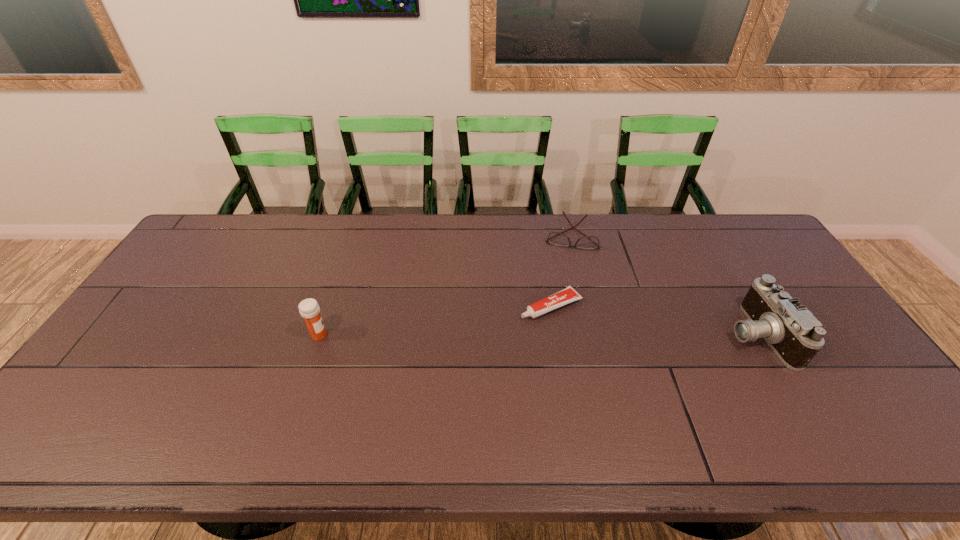
Locate an element on the screen. This screenshot has width=960, height=540. free location located 0.320m at the nozzle of the shortest object is located at coordinates (x=425, y=359).

The image size is (960, 540). Find the location of `free location located 0.150m at the nozzle of the shortest object`. free location located 0.150m at the nozzle of the shortest object is located at coordinates (480, 334).

Locate an element on the screen. The height and width of the screenshot is (540, 960). free location located on the front-facing side of the farthest object is located at coordinates (565, 272).

The image size is (960, 540). What are the coordinates of `vacant space located 0.080m on the front-facing side of the farthest object` in the screenshot? It's located at (565, 266).

Locate an element on the screen. The image size is (960, 540). vacant point located on the front-facing side of the farthest object is located at coordinates (561, 312).

The width and height of the screenshot is (960, 540). Identify the location of object situated at the far edge. (555, 238).

Locate an element on the screen. object that is at the right edge is located at coordinates (792, 332).

Identify the location of free space at the far edge of the desktop. (696, 244).

The height and width of the screenshot is (540, 960). In order to click on free space at the near edge of the desktop in this screenshot , I will do [649, 392].

Image resolution: width=960 pixels, height=540 pixels. In the image, there is a desktop. In order to click on vacant area at the left edge in this screenshot , I will do `click(154, 312)`.